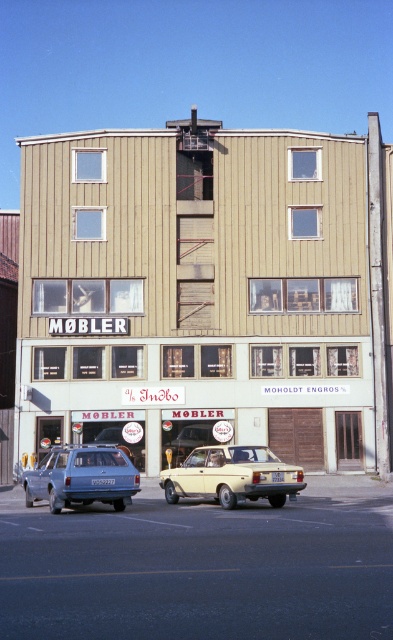
Question: Estimate the real-world distances between objects in this image. Which object is farther from the wooden furniture at center?

Choices:
 (A) yellow matte car at center
 (B) matte blue station wagon at lower left

Answer: (A)

Question: Which of the following is the closest to the observer?

Choices:
 (A) (255, 458)
 (B) (268, 164)

Answer: (A)

Question: Can you confirm if wooden furniture at center is positioned to the right of matte blue station wagon at lower left?

Choices:
 (A) no
 (B) yes

Answer: (B)

Question: Which point appears closest to the camera in this image?

Choices:
 (A) (106, 467)
 (B) (80, 387)
 (C) (222, 502)

Answer: (A)

Question: Does wooden furniture at center have a smaller size compared to matte blue station wagon at lower left?

Choices:
 (A) no
 (B) yes

Answer: (A)

Question: Does wooden furniture at center have a smaller size compared to yellow matte car at center?

Choices:
 (A) yes
 (B) no

Answer: (B)